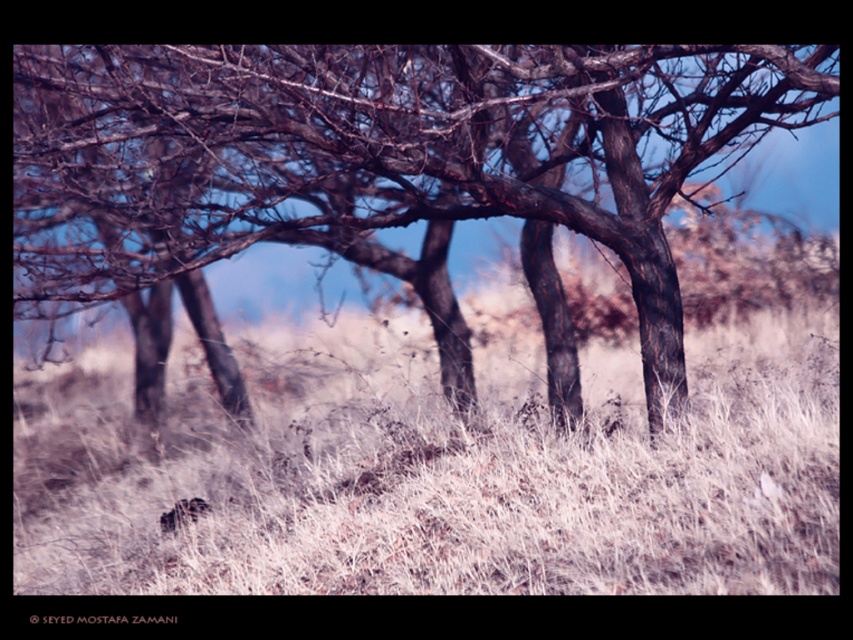
Question: Which of the following is the farthest from the observer?

Choices:
 (A) (447, 186)
 (B) (323, 452)

Answer: (A)

Question: Can you confirm if dry grass at center is positioned to the left of brown bark tree at center?

Choices:
 (A) no
 (B) yes

Answer: (A)

Question: Is dry grass at center below brown bark tree at center?

Choices:
 (A) yes
 (B) no

Answer: (A)

Question: Does dry grass at center have a larger size compared to brown bark tree at center?

Choices:
 (A) no
 (B) yes

Answer: (A)